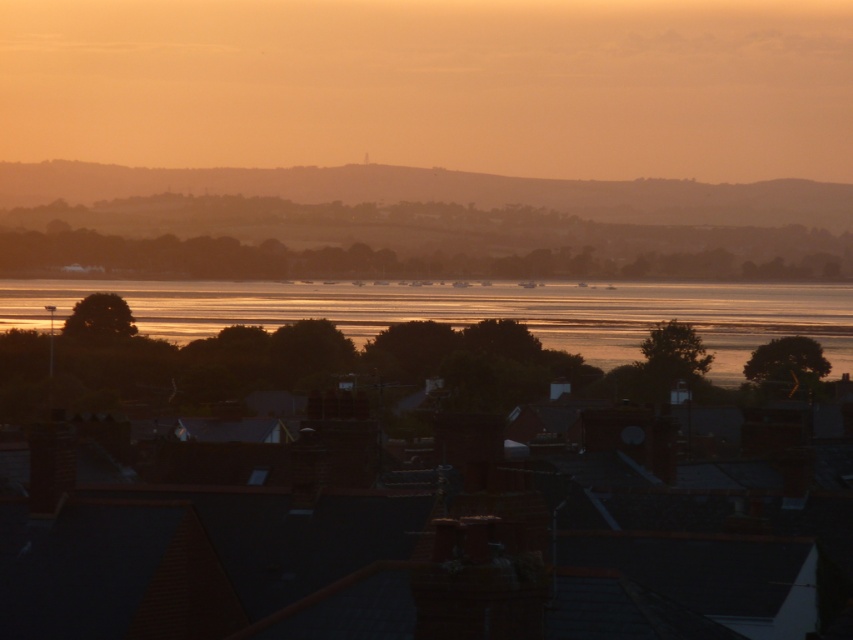
You are a drone operator trying to capture the sunset reflection on the silvery metallic water at center. The drone has a camera with a 50mm lens that can focus on objects within a 0.5 meter radius. If the drone is currently at coordinates point 0.352, 0.485, can it capture the reflection without moving?

The silvery metallic water at center is located exactly at point (413, 225), so the drone can capture the reflection without moving since it is already positioned directly above the water.

You are an architect designing a new building that needs to align with the existing rooftops in the sunset scene. The building will have two sections, one with a silvery metallic water at center and another with a shiny metallic water at center. Which section should be placed higher to match the scene?

The silvery metallic water at center should be placed higher than the shiny metallic water at center to match the scene.

You are standing at the edge of the water in the sunset scene. You want to throw a small pebble into the silvery metallic water at center. Considering the distance, will the pebble reach the water if you throw it with a typical human throwing distance of 100 feet?

The silvery metallic water at center is 1015.30 feet away from you. Since the typical human throwing distance is only 100 feet, the pebble will not reach the water.